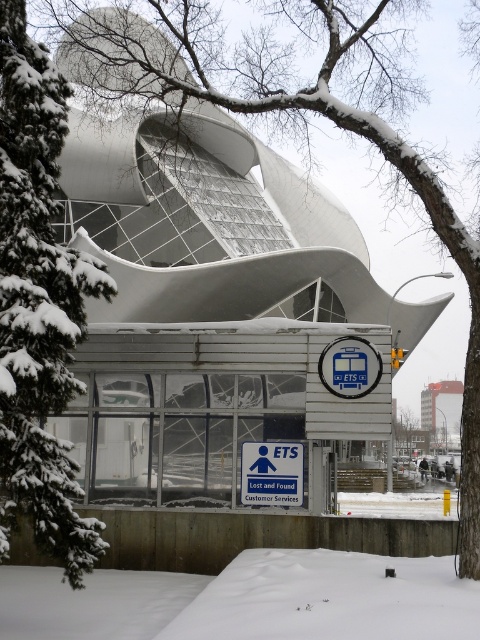
Question: Is white fluffy snow at lower center to the right of white plastic bus stop sign at center from the viewer's perspective?

Choices:
 (A) yes
 (B) no

Answer: (B)

Question: Which of the following is the closest to the observer?

Choices:
 (A) pyautogui.click(x=328, y=596)
 (B) pyautogui.click(x=276, y=456)
 (C) pyautogui.click(x=360, y=378)
 (D) pyautogui.click(x=38, y=435)

Answer: (A)

Question: Which point appears closest to the camera in this image?

Choices:
 (A) (330, 358)
 (B) (269, 502)
 (C) (126, 616)
 (D) (421, 420)

Answer: (C)

Question: Can you confirm if blue plastic sign at center is bigger than white plastic bus stop sign at center?

Choices:
 (A) yes
 (B) no

Answer: (A)

Question: Considering the real-world distances, which object is closest to the white plastic bus stop sign at center?

Choices:
 (A) red brick building at center
 (B) blue plastic sign at center
 (C) green snow-covered evergreen at left
 (D) white fluffy snow at lower center

Answer: (B)

Question: Does white fluffy snow at lower center come behind white plastic bus stop sign at center?

Choices:
 (A) yes
 (B) no

Answer: (B)